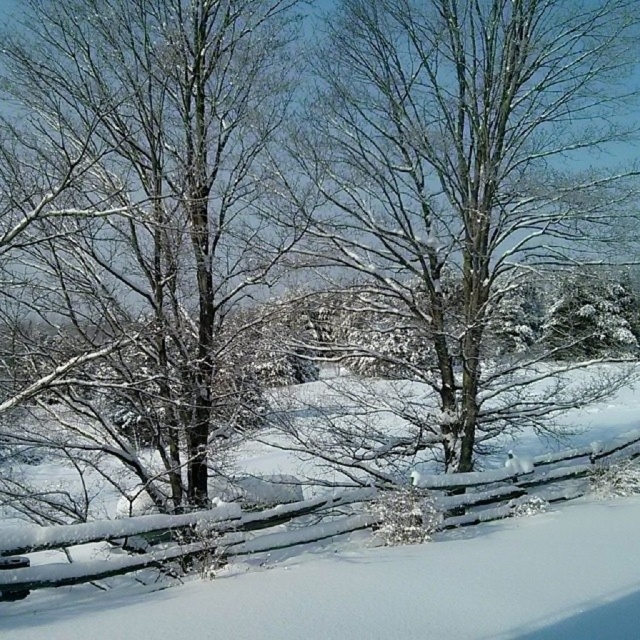
You are standing in the winter landscape scene. There are two points marked in the image. The first point is at coordinate point (x=86, y=172) and the second is at point (x=621, y=404). If you were to walk from the first point to the second point, would you be moving towards the foreground or the background of the image?

Moving from point (x=86, y=172) to point (x=621, y=404) would be moving towards the background of the image because point (x=86, y=172) is closer to the camera than point (x=621, y=404).